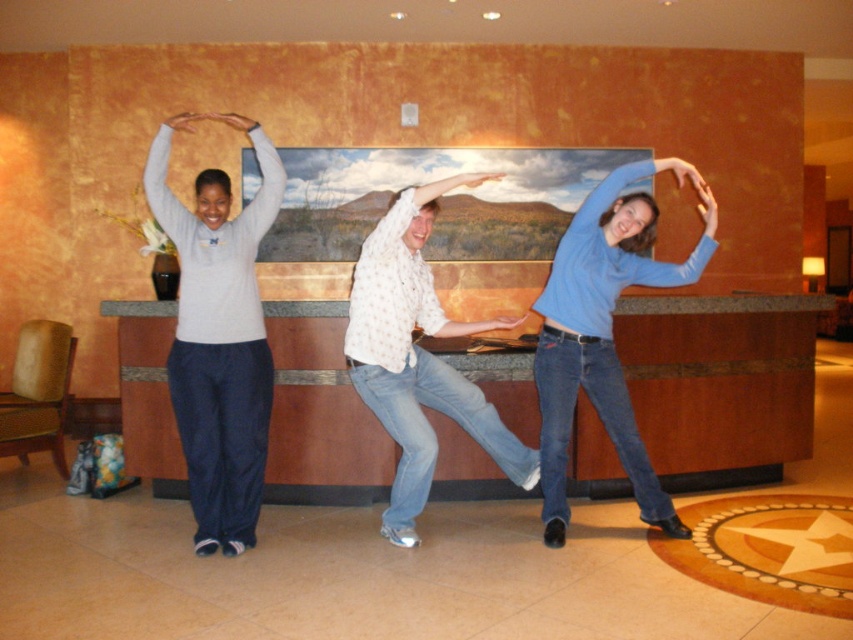
Looking at this image, you are standing at the entrance of the hotel lobby and want to approach the reception desk. There are two guests in front of you wearing a matte gray sweater at left and a white dotted shirt at center. If you walk straight ahead, which guest will you reach first?

The matte gray sweater at left is closer to you than the white dotted shirt at center, so you will reach the guest wearing the matte gray sweater at left first.